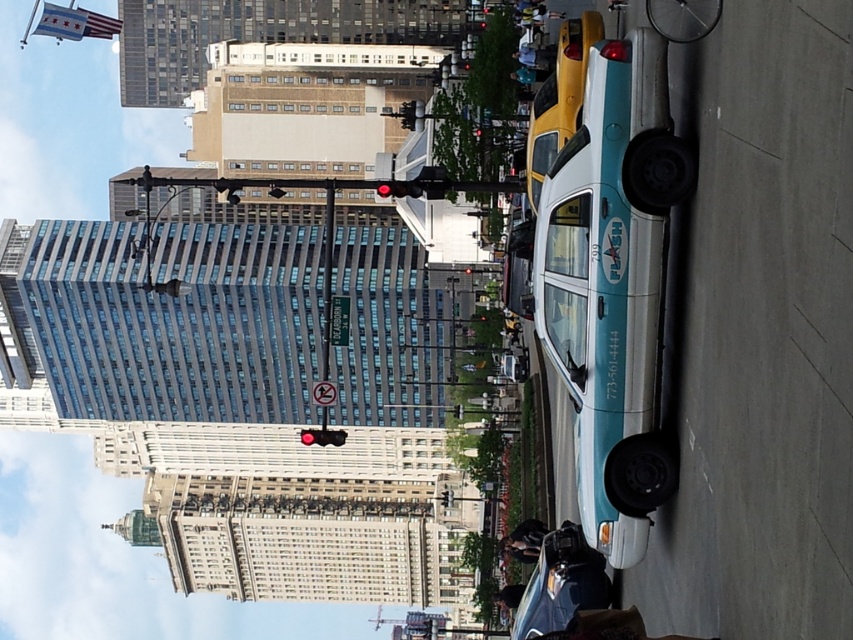
You are a pedestrian standing at the crosswalk and see the teal glossy taxi at center and the teal glossy taxi at lower right. Which taxi is closer to you?

The teal glossy taxi at center is closer to you because it is positioned over the teal glossy taxi at lower right, indicating it is in front.

You are a pedestrian standing on the sidewalk and see the teal glossy taxi at center and the teal glossy taxi at lower right. Which taxi appears bigger to you?

The teal glossy taxi at center appears bigger than the teal glossy taxi at lower right because it is larger in size according to the description.

You are a delivery person needing to load a large package into the teal glossy taxi at center or the teal glossy taxi at lower right. Which taxi should you choose based on their height?

The teal glossy taxi at center is much taller than the teal glossy taxi at lower right, so you should choose the teal glossy taxi at center to load your large package.